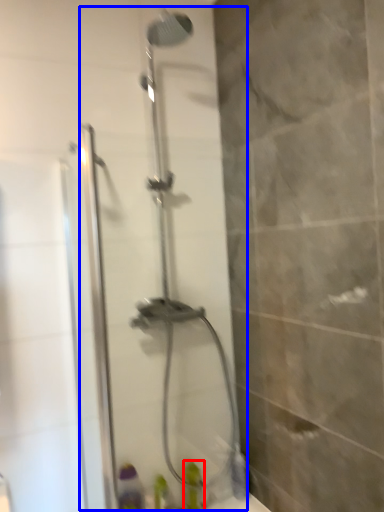
Question: Which of the following is the farthest to the observer, toiletry (highlighted by a red box) or shower door (highlighted by a blue box)?

Choices:
 (A) toiletry
 (B) shower door

Answer: (A)